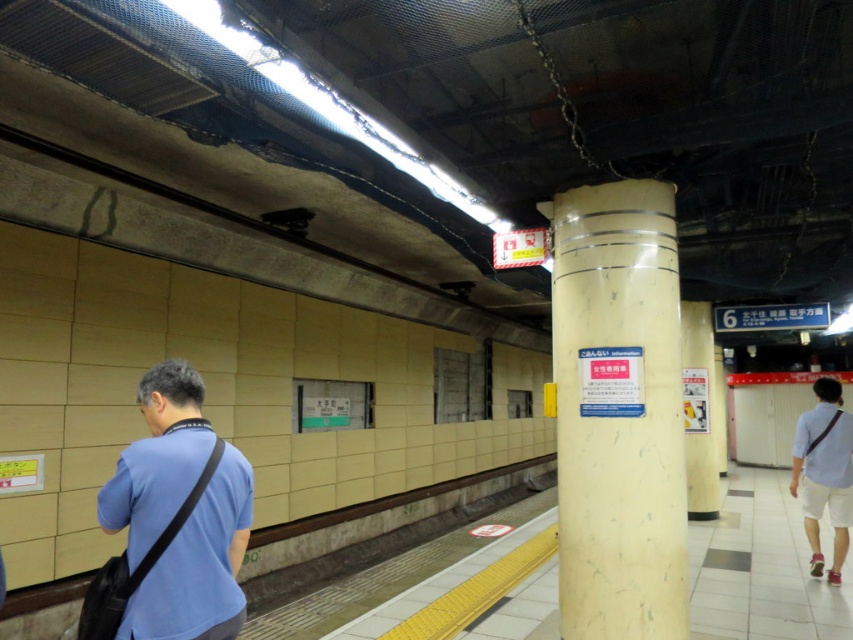
Question: Is yellow matte pillar at center positioned in front of blue fabric bag at left?

Choices:
 (A) no
 (B) yes

Answer: (A)

Question: Is yellow matte pillar at center below blue fabric bag at left?

Choices:
 (A) no
 (B) yes

Answer: (A)

Question: Among these points, which one is nearest to the camera?

Choices:
 (A) (815, 476)
 (B) (213, 497)
 (C) (665, 595)

Answer: (B)

Question: Is blue fabric bag at left positioned behind white cotton shorts at right?

Choices:
 (A) no
 (B) yes

Answer: (A)

Question: Among these objects, which one is nearest to the camera?

Choices:
 (A) yellow matte pillar at center
 (B) blue fabric bag at left

Answer: (B)

Question: Which object appears farthest from the camera in this image?

Choices:
 (A) white cotton shorts at right
 (B) blue fabric bag at left
 (C) yellow matte pillar at center

Answer: (A)